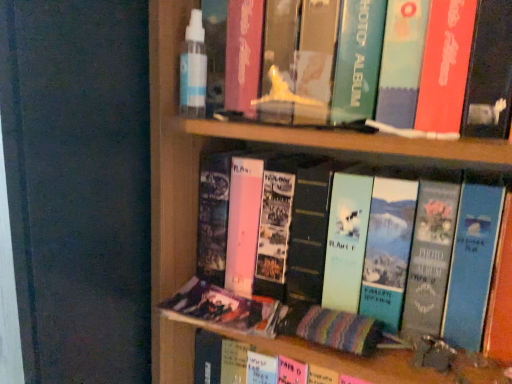
What do you see at coordinates (303, 246) in the screenshot? I see `matte green photo album at center, placed as the first book when sorted from top to bottom` at bounding box center [303, 246].

Identify the location of matte green photo album at center, placed as the first book when sorted from top to bottom. The image size is (512, 384). (303, 246).

Consider the image. Measure the distance between point (175, 299) and camera.

The depth of point (175, 299) is 26.26 inches.

What do you see at coordinates (223, 309) in the screenshot? Image resolution: width=512 pixels, height=384 pixels. I see `matte plastic photo album at lower center, which ranks as the 1th book in bottom-to-top order` at bounding box center [223, 309].

Identify the location of matte plastic photo album at lower center, the second book from the top. (223, 309).

The image size is (512, 384). I want to click on matte green photo album at center, placed as the first book when sorted from top to bottom, so point(303,246).

Is matte green photo album at center, placed as the first book when sorted from top to bottom, at the right side of matte plastic photo album at lower center, which ranks as the 1th book in bottom-to-top order?

Indeed, matte green photo album at center, placed as the first book when sorted from top to bottom, is positioned on the right side of matte plastic photo album at lower center, which ranks as the 1th book in bottom-to-top order.

Which is in front, matte green photo album at center, placed as the first book when sorted from top to bottom, or matte plastic photo album at lower center, which ranks as the 1th book in bottom-to-top order?

matte green photo album at center, placed as the first book when sorted from top to bottom, is more forward.

Which is nearer, (314, 271) or (263, 305)?

Point (314, 271).

From the image's perspective, which is below, matte green photo album at center, placed as the first book when sorted from top to bottom, or matte plastic photo album at lower center, which ranks as the 1th book in bottom-to-top order?

matte plastic photo album at lower center, which ranks as the 1th book in bottom-to-top order, from the image's perspective.

From a real-world perspective, between matte green photo album at center, the 2th book ordered from the bottom, and matte plastic photo album at lower center, which ranks as the 1th book in bottom-to-top order, who is vertically lower?

matte plastic photo album at lower center, which ranks as the 1th book in bottom-to-top order, from a real-world perspective.

Does matte green photo album at center, the 2th book ordered from the bottom, have a lesser width compared to matte plastic photo album at lower center, which ranks as the 1th book in bottom-to-top order?

In fact, matte green photo album at center, the 2th book ordered from the bottom, might be wider than matte plastic photo album at lower center, which ranks as the 1th book in bottom-to-top order.

Based on the photo, who is shorter, matte green photo album at center, placed as the first book when sorted from top to bottom, or matte plastic photo album at lower center, which ranks as the 1th book in bottom-to-top order?

matte plastic photo album at lower center, which ranks as the 1th book in bottom-to-top order.

Can you confirm if matte green photo album at center, placed as the first book when sorted from top to bottom, is bigger than matte plastic photo album at lower center, which ranks as the 1th book in bottom-to-top order?

Yes, matte green photo album at center, placed as the first book when sorted from top to bottom, is bigger than matte plastic photo album at lower center, which ranks as the 1th book in bottom-to-top order.

Is matte green photo album at center, the 2th book ordered from the bottom, located outside matte plastic photo album at lower center, the second book from the top?

That's correct, matte green photo album at center, the 2th book ordered from the bottom, is outside of matte plastic photo album at lower center, the second book from the top.

Is matte green photo album at center, the 2th book ordered from the bottom, positioned far away from matte plastic photo album at lower center, the second book from the top?

No, matte green photo album at center, the 2th book ordered from the bottom, is not far from matte plastic photo album at lower center, the second book from the top.

Is matte green photo album at center, placed as the first book when sorted from top to bottom, positioned with its back to matte plastic photo album at lower center, which ranks as the 1th book in bottom-to-top order?

matte green photo album at center, placed as the first book when sorted from top to bottom, does not have its back to matte plastic photo album at lower center, which ranks as the 1th book in bottom-to-top order.

Locate an element on the screen. This screenshot has height=384, width=512. book above the matte plastic photo album at lower center, which ranks as the 1th book in bottom-to-top order (from the image's perspective) is located at coordinates (303, 246).

Which object is positioned more to the right, matte plastic photo album at lower center, the second book from the top, or matte green photo album at center, placed as the first book when sorted from top to bottom?

matte green photo album at center, placed as the first book when sorted from top to bottom, is more to the right.

Which object is further away from the camera, matte plastic photo album at lower center, the second book from the top, or matte green photo album at center, placed as the first book when sorted from top to bottom?

matte plastic photo album at lower center, the second book from the top, is further away from the camera.

Does point (238, 305) come closer to viewer compared to point (209, 275)?

Yes, point (238, 305) is in front of point (209, 275).

From the image's perspective, which is above, matte plastic photo album at lower center, which ranks as the 1th book in bottom-to-top order, or matte green photo album at center, placed as the first book when sorted from top to bottom?

matte green photo album at center, placed as the first book when sorted from top to bottom, is shown above in the image.

From a real-world perspective, is matte plastic photo album at lower center, the second book from the top, physically located above or below matte green photo album at center, the 2th book ordered from the bottom?

In terms of real-world spatial position, matte plastic photo album at lower center, the second book from the top, is below matte green photo album at center, the 2th book ordered from the bottom.

Does matte plastic photo album at lower center, which ranks as the 1th book in bottom-to-top order, have a lesser width compared to matte green photo album at center, placed as the first book when sorted from top to bottom?

Indeed, matte plastic photo album at lower center, which ranks as the 1th book in bottom-to-top order, has a lesser width compared to matte green photo album at center, placed as the first book when sorted from top to bottom.

Who is shorter, matte plastic photo album at lower center, which ranks as the 1th book in bottom-to-top order, or matte green photo album at center, placed as the first book when sorted from top to bottom?

With less height is matte plastic photo album at lower center, which ranks as the 1th book in bottom-to-top order.

Does matte plastic photo album at lower center, which ranks as the 1th book in bottom-to-top order, have a smaller size compared to matte green photo album at center, placed as the first book when sorted from top to bottom?

Yes.

Is matte plastic photo album at lower center, which ranks as the 1th book in bottom-to-top order, not inside matte green photo album at center, placed as the first book when sorted from top to bottom?

Yes, matte plastic photo album at lower center, which ranks as the 1th book in bottom-to-top order, is not within matte green photo album at center, placed as the first book when sorted from top to bottom.

Is matte plastic photo album at lower center, the second book from the top, beside matte green photo album at center, the 2th book ordered from the bottom?

They are not placed beside each other.

Is matte plastic photo album at lower center, the second book from the top, positioned with its back to matte green photo album at center, the 2th book ordered from the bottom?

Yes, matte plastic photo album at lower center, the second book from the top, is positioned with its back facing matte green photo album at center, the 2th book ordered from the bottom.

I want to click on book located on the right of matte plastic photo album at lower center, which ranks as the 1th book in bottom-to-top order, so click(303, 246).

At what (x,y) coordinates should I click in order to perform the action: click on book below the matte green photo album at center, the 2th book ordered from the bottom (from the image's perspective). Please return your answer as a coordinate pair (x, y). Looking at the image, I should click on click(x=223, y=309).

Find the location of a particular element. This screenshot has height=384, width=512. book that appears in front of the matte plastic photo album at lower center, which ranks as the 1th book in bottom-to-top order is located at coordinates (303, 246).